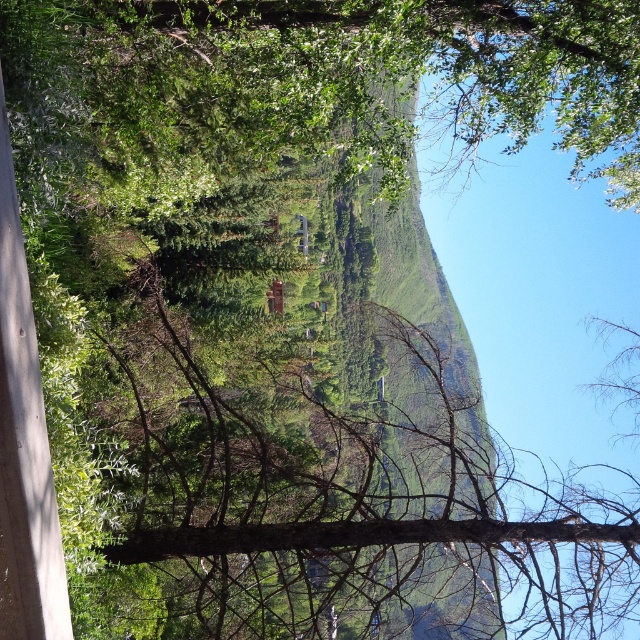
You are standing in the forest and see the matte brown house at center and the transparent glass window at center. Which one is positioned to the left side?

The matte brown house at center is positioned to the left of the transparent glass window at center.

You are standing in a forest and see two points marked in the image. Which point, point (275, 300) or point (304, 218), is closer to you?

Point (275, 300) is closer to the camera than point (304, 218), so the point closer to you is point (275, 300).

You are standing in the forest and see the matte brown house at center and the transparent glass window at center. Which object is taller?

The transparent glass window at center is taller than the matte brown house at center.